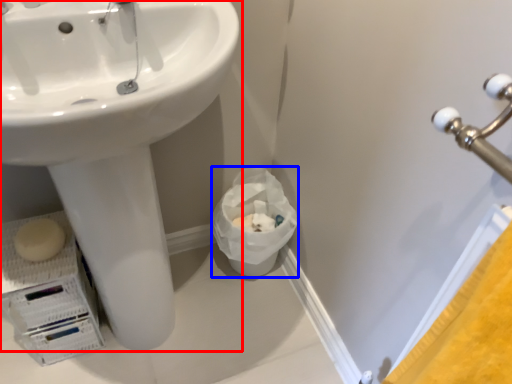
Question: Which object appears closest to the camera in this image, sink (highlighted by a red box) or garbage (highlighted by a blue box)?

Choices:
 (A) sink
 (B) garbage

Answer: (A)